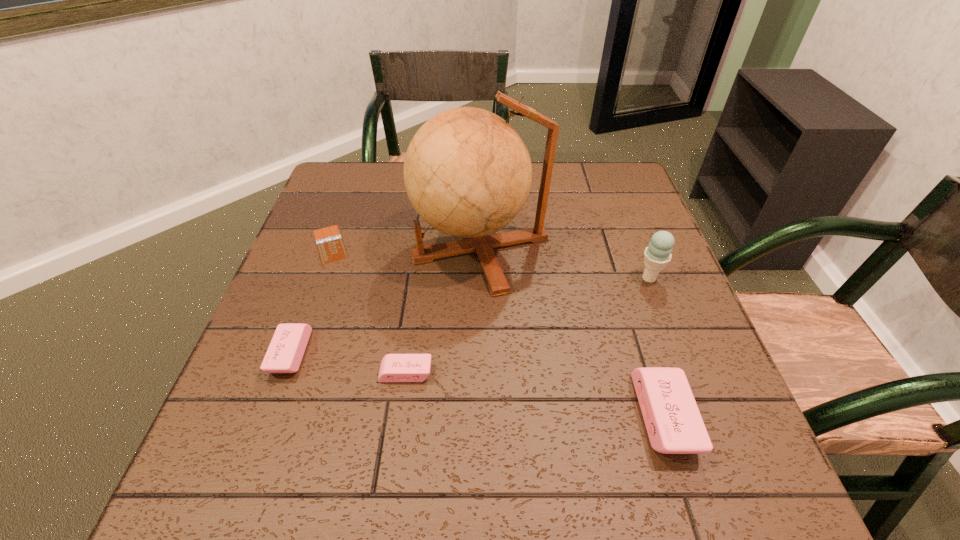
Identify the location of vacant position in the image that satisfies the following two spatial constraints: 1. on the back side of the second tallest object; 2. on the right side of the rightmost eraser. (620, 278).

The width and height of the screenshot is (960, 540). Identify the location of free location that satisfies the following two spatial constraints: 1. on the front side of the rightmost eraser; 2. on the right side of the second shortest object. (399, 416).

Image resolution: width=960 pixels, height=540 pixels. Identify the location of free location that satisfies the following two spatial constraints: 1. on the surface of the ice cream; 2. on the left side of the globe. (481, 278).

Where is `free space in the image that satisfies the following two spatial constraints: 1. on the front side of the second shortest eraser; 2. on the left side of the shortest object`? The height and width of the screenshot is (540, 960). free space in the image that satisfies the following two spatial constraints: 1. on the front side of the second shortest eraser; 2. on the left side of the shortest object is located at coordinates (291, 353).

Where is `vacant area that satisfies the following two spatial constraints: 1. on the surface of the tallest object; 2. on the left side of the second tallest object`? The height and width of the screenshot is (540, 960). vacant area that satisfies the following two spatial constraints: 1. on the surface of the tallest object; 2. on the left side of the second tallest object is located at coordinates (481, 278).